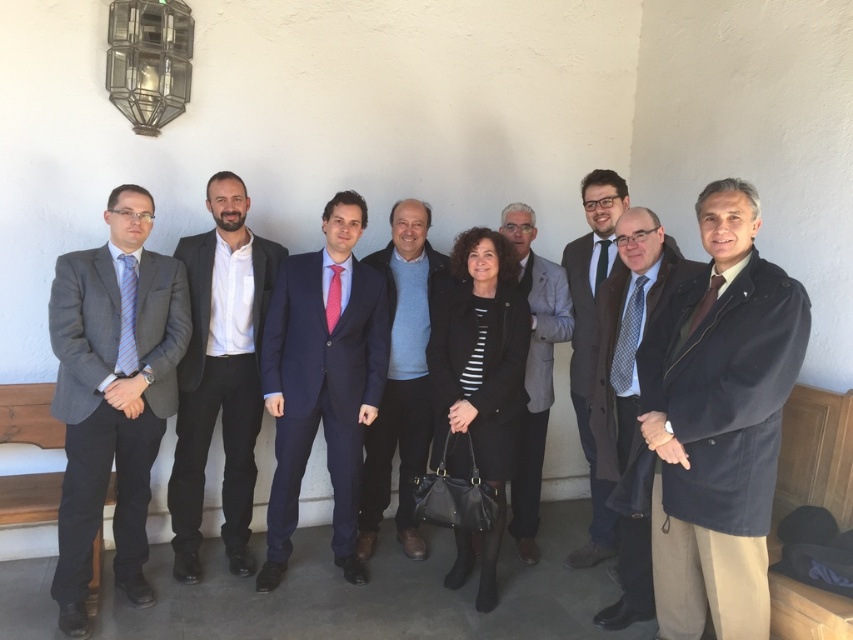
Question: Is gray striped suit at left thinner than dark brown leather coat at center?

Choices:
 (A) yes
 (B) no

Answer: (B)

Question: Does gray striped suit at left have a larger size compared to blue sweater at center?

Choices:
 (A) yes
 (B) no

Answer: (A)

Question: Among these points, which one is nearest to the camera?

Choices:
 (A) (x=433, y=401)
 (B) (x=157, y=394)

Answer: (B)

Question: Which object appears farthest from the camera in this image?

Choices:
 (A) black leather coat at center
 (B) dark brown leather coat at center

Answer: (B)

Question: Is dark brown wool coat at right above dark brown leather coat at center?

Choices:
 (A) yes
 (B) no

Answer: (B)

Question: Which point appears closest to the camera in this image?

Choices:
 (A) (611, 484)
 (B) (538, 508)
 (C) (456, 404)

Answer: (C)